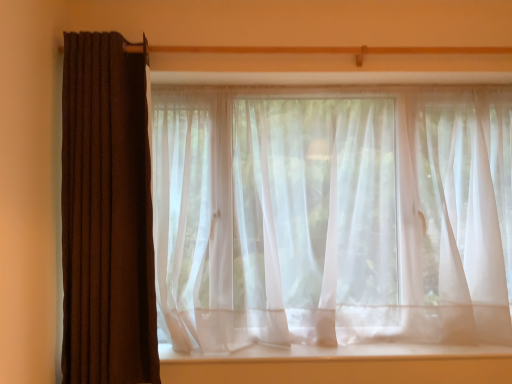
This screenshot has width=512, height=384. Identify the location of sheer white curtain at center, acting as the second curtain starting from the left. (332, 215).

Looking at this image, is brown textured curtain at left, which appears as the 2th curtain when viewed from the right, shorter than white sheer fabric at center?

In fact, brown textured curtain at left, which appears as the 2th curtain when viewed from the right, may be taller than white sheer fabric at center.

How different are the orientations of brown textured curtain at left, which appears as the 2th curtain when viewed from the right, and white sheer fabric at center in degrees?

0.000894 degrees.

In terms of size, does brown textured curtain at left, which is the 1th curtain in left-to-right order, appear bigger or smaller than white sheer fabric at center?

Clearly, brown textured curtain at left, which is the 1th curtain in left-to-right order, is larger in size than white sheer fabric at center.

Is white sheer fabric at center aimed at sheer white curtain at center, acting as the second curtain starting from the left?

No, white sheer fabric at center is not facing towards sheer white curtain at center, acting as the second curtain starting from the left.

Can you confirm if white sheer fabric at center is positioned to the right of sheer white curtain at center, acting as the second curtain starting from the left?

Incorrect, white sheer fabric at center is not on the right side of sheer white curtain at center, acting as the second curtain starting from the left.

From a real-world perspective, is white sheer fabric at center positioned above or below sheer white curtain at center, the 1th curtain from the right?

In terms of real-world spatial position, white sheer fabric at center is below sheer white curtain at center, the 1th curtain from the right.

Considering the relative sizes of white sheer fabric at center and sheer white curtain at center, the 1th curtain from the right, in the image provided, is white sheer fabric at center taller than sheer white curtain at center, the 1th curtain from the right,?

No, white sheer fabric at center is not taller than sheer white curtain at center, the 1th curtain from the right.

Considering the positions of objects sheer white curtain at center, the 1th curtain from the right, and brown textured curtain at left, which is the 1th curtain in left-to-right order, in the image provided, who is more to the left, sheer white curtain at center, the 1th curtain from the right, or brown textured curtain at left, which is the 1th curtain in left-to-right order,?

From the viewer's perspective, brown textured curtain at left, which is the 1th curtain in left-to-right order, appears more on the left side.

From the picture: From a real-world perspective, is sheer white curtain at center, acting as the second curtain starting from the left, physically located above or below brown textured curtain at left, which appears as the 2th curtain when viewed from the right?

sheer white curtain at center, acting as the second curtain starting from the left, is below brown textured curtain at left, which appears as the 2th curtain when viewed from the right.

Is sheer white curtain at center, the 1th curtain from the right, taller than brown textured curtain at left, which is the 1th curtain in left-to-right order?

In fact, sheer white curtain at center, the 1th curtain from the right, may be shorter than brown textured curtain at left, which is the 1th curtain in left-to-right order.

How far apart are brown textured curtain at left, which is the 1th curtain in left-to-right order, and sheer white curtain at center, acting as the second curtain starting from the left?

brown textured curtain at left, which is the 1th curtain in left-to-right order, and sheer white curtain at center, acting as the second curtain starting from the left, are 24.63 inches apart from each other.

How many degrees apart are the facing directions of brown textured curtain at left, which appears as the 2th curtain when viewed from the right, and sheer white curtain at center, the 1th curtain from the right?

They differ by 0.358 degrees in their facing directions.

In order to click on curtain in front of the sheer white curtain at center, the 1th curtain from the right in this screenshot , I will do `click(106, 215)`.

Is brown textured curtain at left, which is the 1th curtain in left-to-right order, smaller than sheer white curtain at center, acting as the second curtain starting from the left?

Yes, brown textured curtain at left, which is the 1th curtain in left-to-right order, is smaller than sheer white curtain at center, acting as the second curtain starting from the left.

Considering their positions, is white sheer fabric at center located in front of or behind brown textured curtain at left, which appears as the 2th curtain when viewed from the right?

Clearly, white sheer fabric at center is behind brown textured curtain at left, which appears as the 2th curtain when viewed from the right.

From the image's perspective, is white sheer fabric at center above or below brown textured curtain at left, which is the 1th curtain in left-to-right order?

Based on their image positions, white sheer fabric at center is located beneath brown textured curtain at left, which is the 1th curtain in left-to-right order.

Between point (395, 352) and point (111, 114), which one is positioned behind?

The point (395, 352) is farther.

In the image, there is a brown textured curtain at left, which is the 1th curtain in left-to-right order. What are the coordinates of `window sill below it (from a real-world perspective)` in the screenshot? It's located at (341, 352).

From the image's perspective, relative to white sheer fabric at center, is sheer white curtain at center, acting as the second curtain starting from the left, above or below?

sheer white curtain at center, acting as the second curtain starting from the left, is above white sheer fabric at center.

Considering the relative sizes of sheer white curtain at center, acting as the second curtain starting from the left, and white sheer fabric at center in the image provided, is sheer white curtain at center, acting as the second curtain starting from the left, taller than white sheer fabric at center?

Correct, sheer white curtain at center, acting as the second curtain starting from the left, is much taller as white sheer fabric at center.

How far apart are sheer white curtain at center, acting as the second curtain starting from the left, and white sheer fabric at center?

They are 20.33 inches apart.

Is point (250, 127) closer to viewer compared to point (477, 348)?

That is False.

The image size is (512, 384). What are the coordinates of `window sill located behind the brown textured curtain at left, which is the 1th curtain in left-to-right order` in the screenshot? It's located at click(341, 352).

You are a GUI agent. You are given a task and a screenshot of the screen. Output one action in this format:
    pyautogui.click(x=<x>, y=<y>)
    Task: Click on the 1st curtain above when counting from the white sheer fabric at center (from the image's perspective)
    Image resolution: width=512 pixels, height=384 pixels.
    Given the screenshot: What is the action you would take?
    pyautogui.click(x=332, y=215)

From the image, which object appears to be farther from sheer white curtain at center, acting as the second curtain starting from the left, brown textured curtain at left, which appears as the 2th curtain when viewed from the right, or white sheer fabric at center?

The object further to sheer white curtain at center, acting as the second curtain starting from the left, is brown textured curtain at left, which appears as the 2th curtain when viewed from the right.

Estimate the real-world distances between objects in this image. Which object is closer to brown textured curtain at left, which is the 1th curtain in left-to-right order, sheer white curtain at center, the 1th curtain from the right, or white sheer fabric at center?

sheer white curtain at center, the 1th curtain from the right, lies closer to brown textured curtain at left, which is the 1th curtain in left-to-right order, than the other object.

Based on their spatial positions, is white sheer fabric at center or brown textured curtain at left, which is the 1th curtain in left-to-right order, closer to sheer white curtain at center, the 1th curtain from the right?

The object closer to sheer white curtain at center, the 1th curtain from the right, is white sheer fabric at center.

Which object lies further to the anchor point white sheer fabric at center, sheer white curtain at center, acting as the second curtain starting from the left, or brown textured curtain at left, which is the 1th curtain in left-to-right order?

brown textured curtain at left, which is the 1th curtain in left-to-right order, lies further to white sheer fabric at center than the other object.

Considering their positions, is brown textured curtain at left, which is the 1th curtain in left-to-right order, positioned further to white sheer fabric at center than sheer white curtain at center, acting as the second curtain starting from the left?

brown textured curtain at left, which is the 1th curtain in left-to-right order.

Looking at the image, which one is located closer to brown textured curtain at left, which is the 1th curtain in left-to-right order, white sheer fabric at center or sheer white curtain at center, acting as the second curtain starting from the left?

Among the two, sheer white curtain at center, acting as the second curtain starting from the left, is located nearer to brown textured curtain at left, which is the 1th curtain in left-to-right order.

Where is `window sill between brown textured curtain at left, which appears as the 2th curtain when viewed from the right, and sheer white curtain at center, the 1th curtain from the right, in the horizontal direction`? window sill between brown textured curtain at left, which appears as the 2th curtain when viewed from the right, and sheer white curtain at center, the 1th curtain from the right, in the horizontal direction is located at coordinates (341, 352).